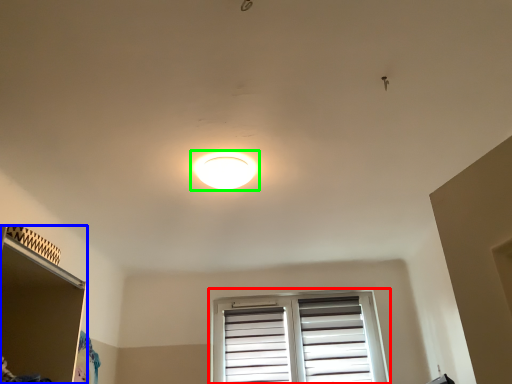
Question: Considering the real-world distances, which object is closest to window (highlighted by a red box)? shelf (highlighted by a blue box) or lamp (highlighted by a green box).

Choices:
 (A) shelf
 (B) lamp

Answer: (B)